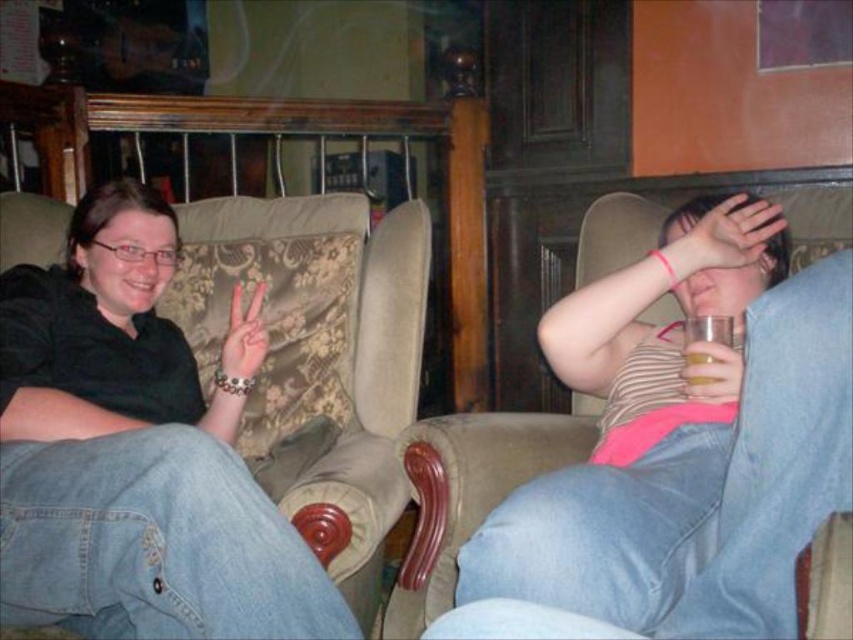
Where is `pink matte hand at center`? This screenshot has height=640, width=853. pink matte hand at center is located at coordinates (242, 337).

Which is behind, point (234, 317) or point (695, 356)?

The point (234, 317) is behind.

You are a GUI agent. You are given a task and a screenshot of the screen. Output one action in this format:
    pyautogui.click(x=<x>, y=<y>)
    Task: Click on the pink matte hand at center
    The height and width of the screenshot is (640, 853).
    Given the screenshot: What is the action you would take?
    pyautogui.click(x=242, y=337)

I want to click on pink matte hand at center, so click(x=242, y=337).

Can you confirm if black matte shirt at left is positioned above translucent glass at right?

Incorrect, black matte shirt at left is not positioned above translucent glass at right.

Between black matte shirt at left and translucent glass at right, which one has less height?

With less height is translucent glass at right.

What do you see at coordinates (132, 456) in the screenshot? The width and height of the screenshot is (853, 640). I see `black matte shirt at left` at bounding box center [132, 456].

At what (x,y) coordinates should I click in order to perform the action: click on black matte shirt at left. Please return your answer as a coordinate pair (x, y). The width and height of the screenshot is (853, 640). Looking at the image, I should click on (132, 456).

Can you confirm if black matte shirt at left is positioned below pink matte hand at center?

Yes, black matte shirt at left is below pink matte hand at center.

You are a GUI agent. You are given a task and a screenshot of the screen. Output one action in this format:
    pyautogui.click(x=<x>, y=<y>)
    Task: Click on the black matte shirt at left
    This screenshot has width=853, height=640.
    Given the screenshot: What is the action you would take?
    pyautogui.click(x=132, y=456)